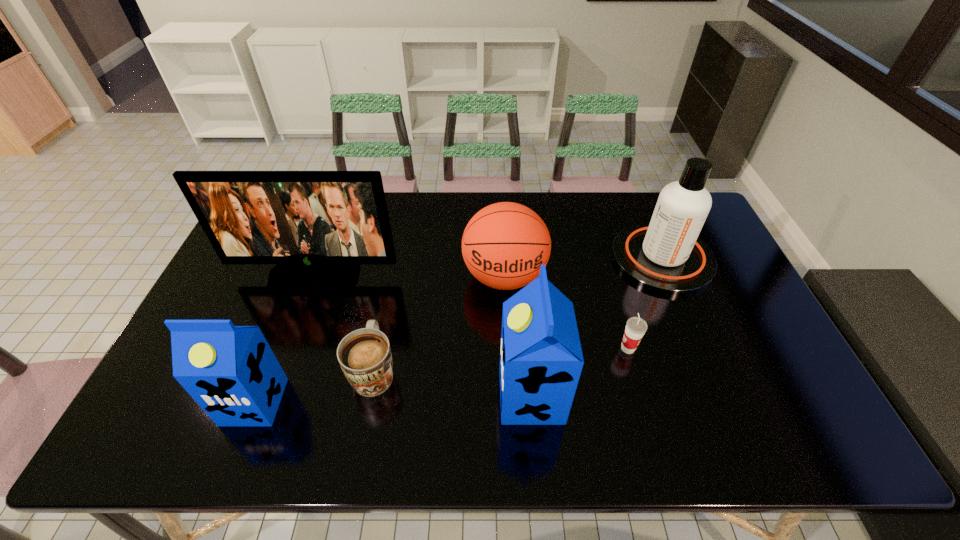
Where is `vacant region between the third shortest object and the monitor`? The height and width of the screenshot is (540, 960). vacant region between the third shortest object and the monitor is located at coordinates (410, 276).

In order to click on vacant area between the rightmost object and the fifth tallest object in this screenshot , I will do `click(584, 268)`.

Locate which object ranks sixth in proximity to the sixth object from left to right. Please provide its 2D coordinates. Your answer should be formatted as a tuple, i.e. [(x, y)], where the tuple contains the x and y coordinates of a point satisfying the conditions above.

[(231, 372)]

I want to click on object that is the third nearest to the left carton, so click(504, 245).

The width and height of the screenshot is (960, 540). In order to click on vacant space that satisfies the following two spatial constraints: 1. on the side of the mug with the handle; 2. on the right side of the rightmost object in this screenshot , I will do `click(396, 259)`.